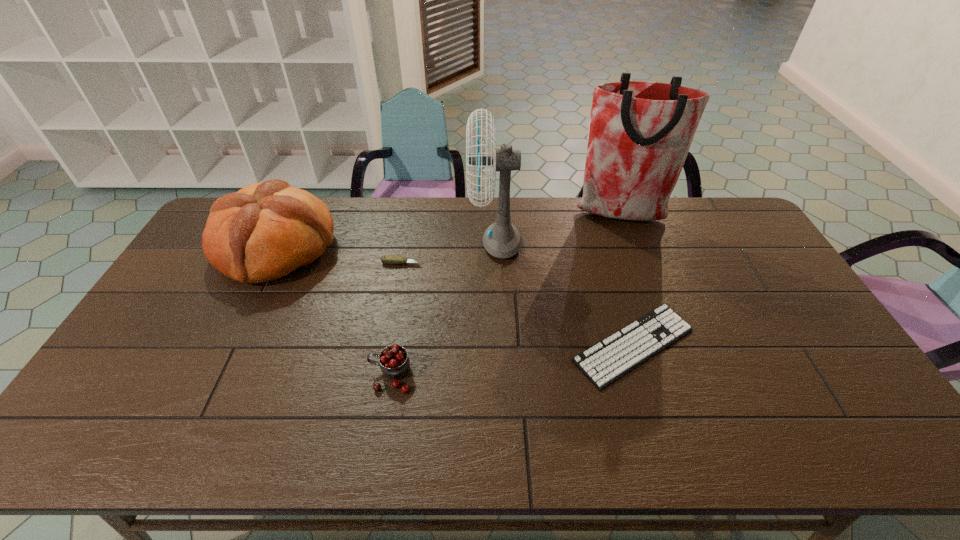
Image resolution: width=960 pixels, height=540 pixels. In order to click on free spot that satisfies the following two spatial constraints: 1. on the front-facing side of the fourth object from left to right; 2. on the right side of the computer keyboard in this screenshot , I will do `click(499, 346)`.

You are a GUI agent. You are given a task and a screenshot of the screen. Output one action in this format:
    pyautogui.click(x=<x>, y=<y>)
    Task: Click on the free spot that satisfies the following two spatial constraints: 1. on the front-facing side of the fourth object from left to right; 2. on the back side of the shortest object
    This screenshot has height=540, width=960.
    Given the screenshot: What is the action you would take?
    pyautogui.click(x=499, y=346)